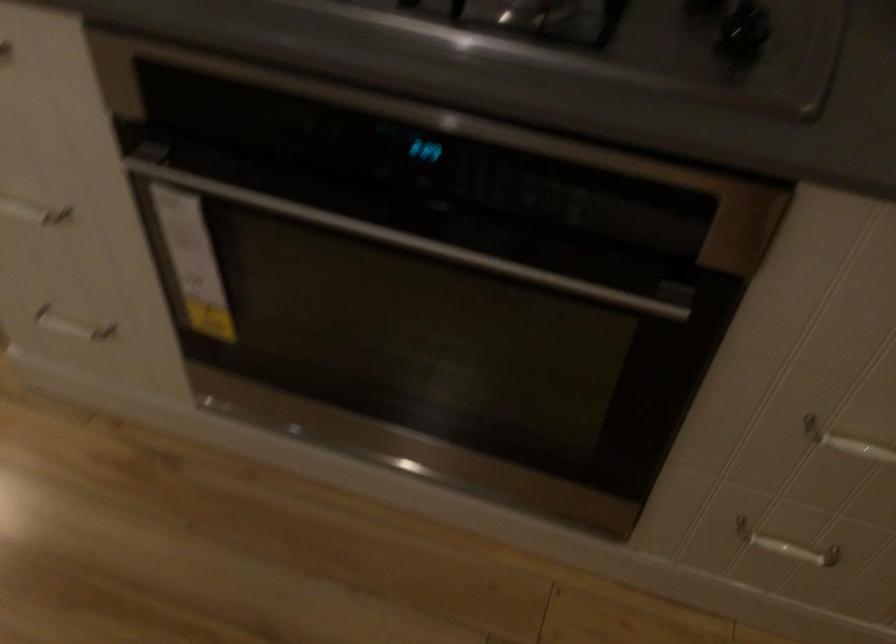
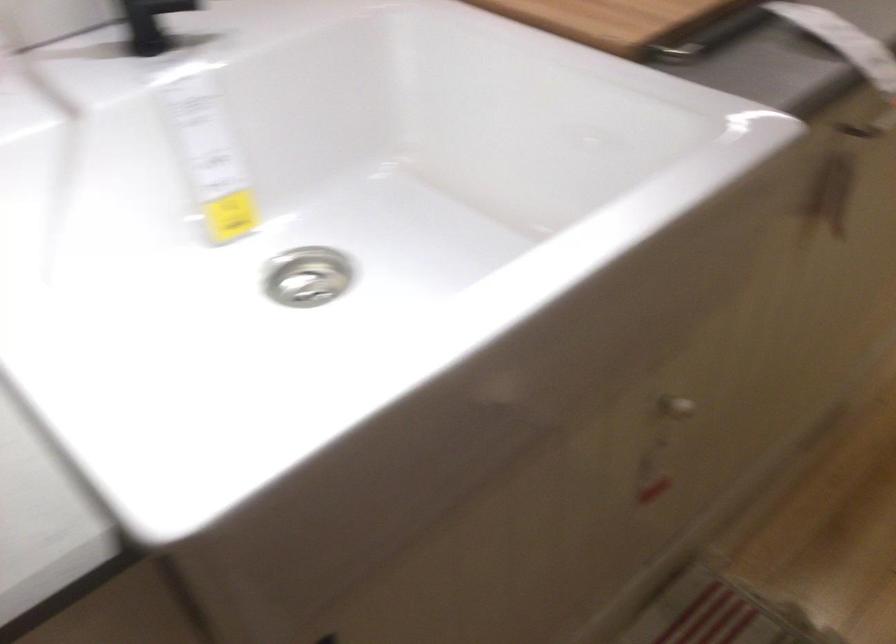
How did the camera likely rotate?

The camera's rotation is toward left-down.